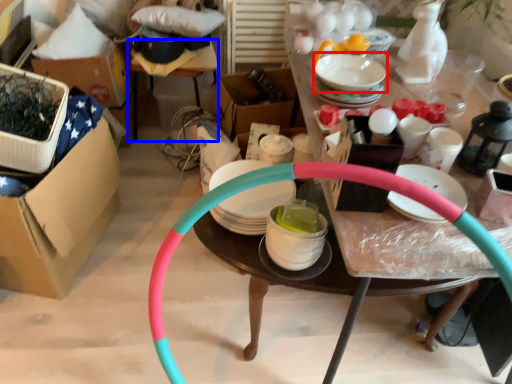
Question: Which object is further to the camera taking this photo, tableware (highlighted by a red box) or table (highlighted by a blue box)?

Choices:
 (A) tableware
 (B) table

Answer: (B)